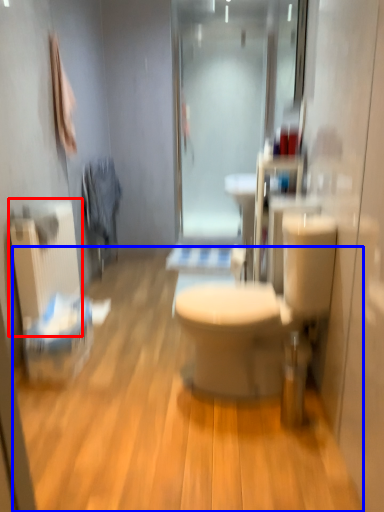
Question: Which of the following is the closest to the observer, radiator (highlighted by a red box) or plain (highlighted by a blue box)?

Choices:
 (A) radiator
 (B) plain

Answer: (B)